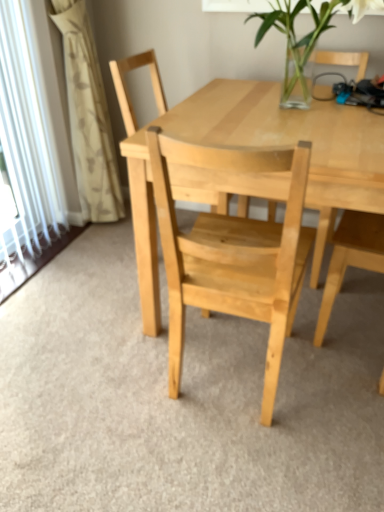
The width and height of the screenshot is (384, 512). Identify the location of clear glass vase at upper center. (305, 36).

Locate an element on the screen. This screenshot has width=384, height=512. white textured curtain at left is located at coordinates (88, 116).

This screenshot has height=512, width=384. What do you see at coordinates (127, 90) in the screenshot? I see `natural wood chair at center` at bounding box center [127, 90].

What is the approximate height of natural wood chair at center?

87.14 centimeters.

Describe the element at coordinates (291, 139) in the screenshot. The height and width of the screenshot is (512, 384). I see `natural wood table at center` at that location.

Identify the location of clear glass vase at upper center. The height and width of the screenshot is (512, 384). point(305,36).

Considering the relative sizes of natural wood chair at center and natural wood table at center in the image provided, is natural wood chair at center bigger than natural wood table at center?

No, natural wood chair at center is not bigger than natural wood table at center.

Is the position of natural wood chair at center less distant than that of natural wood table at center?

No.

I want to click on round table below the natural wood chair at center (from the image's perspective), so click(x=291, y=139).

Would you say natural wood chair at center contains natural wood table at center?

No, natural wood table at center is not a part of natural wood chair at center.

Is natural wood table at center placed right next to natural wood chair at center?

No, natural wood table at center is not next to natural wood chair at center.

From a real-world perspective, is natural wood table at center physically below natural wood chair at center?

Yes.

Considering the points (377, 206) and (191, 193), which point is behind, point (377, 206) or point (191, 193)?

Positioned behind is point (191, 193).

Which object is positioned more to the right, natural wood table at center or natural wood chair at center?

From the viewer's perspective, natural wood table at center appears more on the right side.

Considering the sizes of objects clear glass vase at upper center and natural wood chair at center in the image provided, who is thinner, clear glass vase at upper center or natural wood chair at center?

natural wood chair at center is thinner.

Which object is closer to the camera taking this photo, clear glass vase at upper center or natural wood chair at center?

Positioned in front is clear glass vase at upper center.

Considering the positions of objects clear glass vase at upper center and natural wood chair at center in the image provided, who is more to the right, clear glass vase at upper center or natural wood chair at center?

clear glass vase at upper center.

Could you tell me if clear glass vase at upper center is turned towards natural wood chair at center?

No.

Is white textured curtain at left looking in the opposite direction of clear glass vase at upper center?

No, clear glass vase at upper center is not at the back of white textured curtain at left.

Is white textured curtain at left closer to camera compared to clear glass vase at upper center?

That is False.

Considering the sizes of objects white textured curtain at left and clear glass vase at upper center in the image provided, who is thinner, white textured curtain at left or clear glass vase at upper center?

white textured curtain at left.

Looking at this image, does clear glass vase at upper center have a larger size compared to natural wood table at center?

No, clear glass vase at upper center is not bigger than natural wood table at center.

Can you see clear glass vase at upper center touching natural wood table at center?

No.

Identify the location of houseplant located on the right of white textured curtain at left. This screenshot has height=512, width=384. (305, 36).

How many degrees apart are the facing directions of clear glass vase at upper center and white textured curtain at left?

The angle between the facing direction of clear glass vase at upper center and the facing direction of white textured curtain at left is 90 degrees.

Based on the photo, considering the relative sizes of clear glass vase at upper center and white textured curtain at left in the image provided, is clear glass vase at upper center taller than white textured curtain at left?

No.

Based on the photo, considering the positions of objects clear glass vase at upper center and white textured curtain at left in the image provided, who is more to the right, clear glass vase at upper center or white textured curtain at left?

clear glass vase at upper center is more to the right.

How far apart are natural wood chair at center and clear glass vase at upper center?

natural wood chair at center is 25.74 inches away from clear glass vase at upper center.

Does natural wood chair at center turn towards clear glass vase at upper center?

Yes, natural wood chair at center is facing clear glass vase at upper center.

Is natural wood chair at center shorter than clear glass vase at upper center?

No.

In the scene shown: Is natural wood chair at center at the right side of clear glass vase at upper center?

No.

Locate an element on the screen. Image resolution: width=384 pixels, height=512 pixels. chair behind the natural wood table at center is located at coordinates (127, 90).

Where is `round table lying on the right of natural wood chair at center`? The width and height of the screenshot is (384, 512). round table lying on the right of natural wood chair at center is located at coordinates (291, 139).

Estimate the real-world distances between objects in this image. Which object is closer to natural wood table at center, white textured curtain at left or natural wood chair at center?

natural wood chair at center.

Estimate the real-world distances between objects in this image. Which object is further from natural wood chair at center, clear glass vase at upper center or natural wood table at center?

natural wood table at center is positioned further to the anchor natural wood chair at center.

When comparing their distances from clear glass vase at upper center, does white textured curtain at left or natural wood table at center seem closer?

The object closer to clear glass vase at upper center is natural wood table at center.

From the picture: Which object lies nearer to the anchor point white textured curtain at left, natural wood table at center or natural wood chair at center?

natural wood chair at center lies closer to white textured curtain at left than the other object.

Which object lies nearer to the anchor point natural wood chair at center, natural wood table at center or clear glass vase at upper center?

Based on the image, clear glass vase at upper center appears to be nearer to natural wood chair at center.

When comparing their distances from clear glass vase at upper center, does natural wood table at center or white textured curtain at left seem closer?

Among the two, natural wood table at center is located nearer to clear glass vase at upper center.

When comparing their distances from natural wood table at center, does clear glass vase at upper center or white textured curtain at left seem further?

Among the two, white textured curtain at left is located further to natural wood table at center.

Which object lies nearer to the anchor point natural wood table at center, white textured curtain at left or clear glass vase at upper center?

clear glass vase at upper center is positioned closer to the anchor natural wood table at center.

Find the location of a particular element. This screenshot has width=384, height=512. houseplant between white textured curtain at left and natural wood table at center from left to right is located at coordinates (305, 36).

At what (x,y) coordinates should I click in order to perform the action: click on chair between white textured curtain at left and natural wood table at center. Please return your answer as a coordinate pair (x, y). This screenshot has height=512, width=384. Looking at the image, I should click on (127, 90).

Locate an element on the screen. The height and width of the screenshot is (512, 384). chair between clear glass vase at upper center and natural wood table at center vertically is located at coordinates (127, 90).

You are a GUI agent. You are given a task and a screenshot of the screen. Output one action in this format:
    pyautogui.click(x=<x>, y=<y>)
    Task: Click on the chair between white textured curtain at left and clear glass vase at upper center in the horizontal direction
    This screenshot has height=512, width=384.
    Given the screenshot: What is the action you would take?
    pyautogui.click(x=127, y=90)